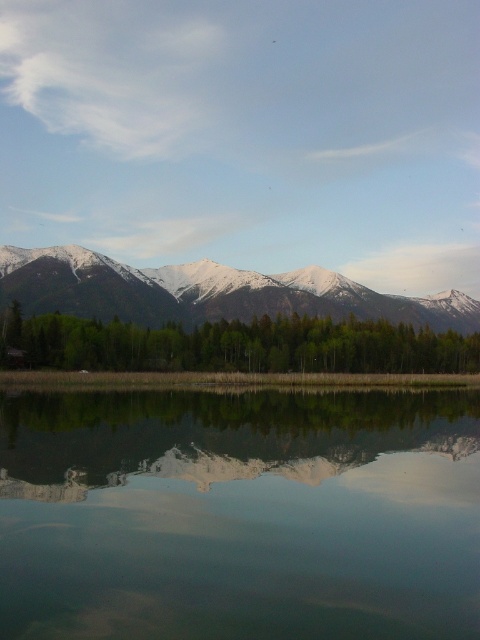
Question: In this image, where is clear glass water at center located relative to green matte trees at center?

Choices:
 (A) right
 (B) left

Answer: (B)

Question: Considering the real-world distances, which object is farthest from the green matte trees at center?

Choices:
 (A) snowy white mountain range at upper center
 (B) clear glass water at center

Answer: (B)

Question: Is clear glass water at center smaller than snowy white mountain range at upper center?

Choices:
 (A) yes
 (B) no

Answer: (A)

Question: Which is farther from the clear glass water at center?

Choices:
 (A) snowy white mountain range at upper center
 (B) green matte trees at center

Answer: (A)

Question: Which of the following is the closest to the observer?

Choices:
 (A) (103, 301)
 (B) (78, 609)

Answer: (B)

Question: Does clear glass water at center have a smaller size compared to green matte trees at center?

Choices:
 (A) no
 (B) yes

Answer: (B)